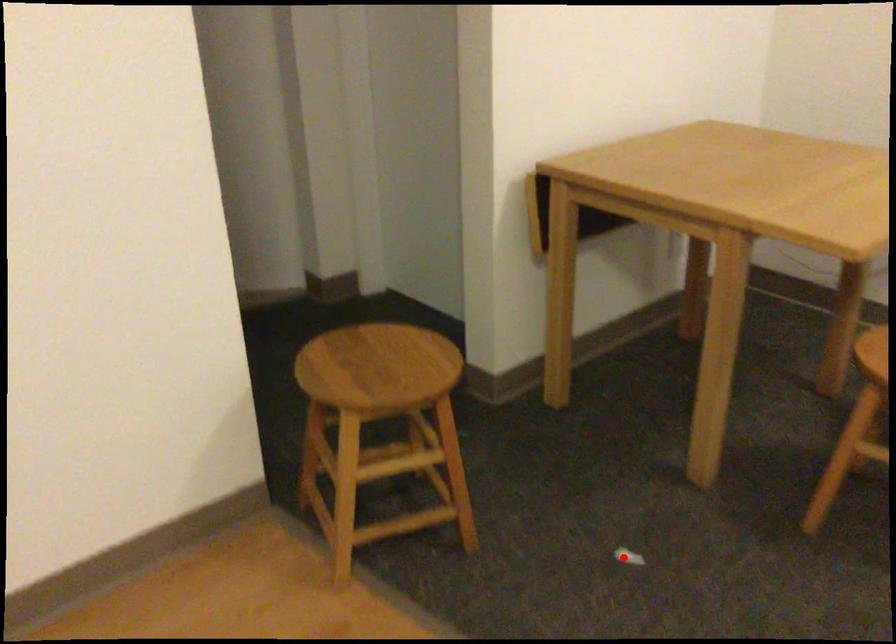
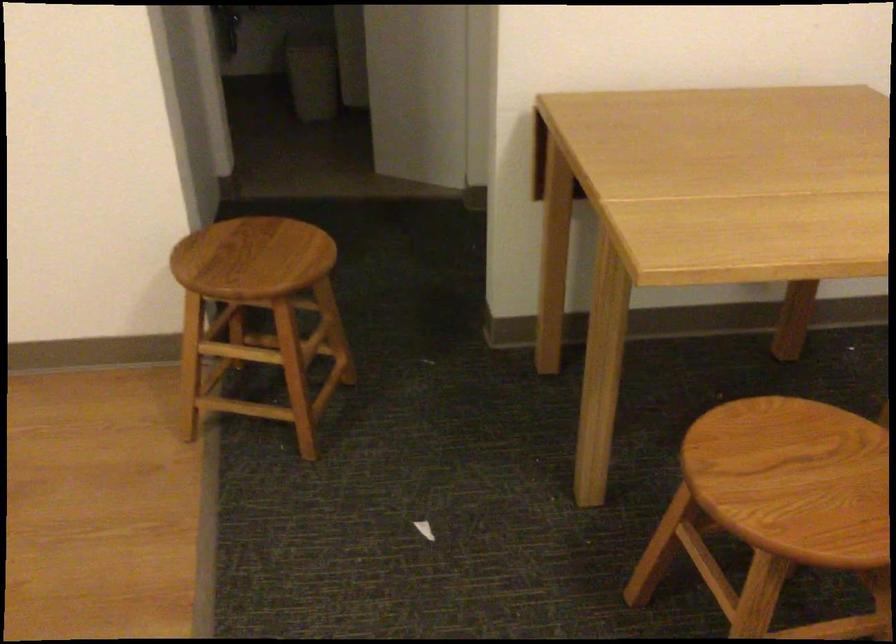
Locate, in the second image, the point that corresponds to the highlighted location in the first image.

(424, 529)